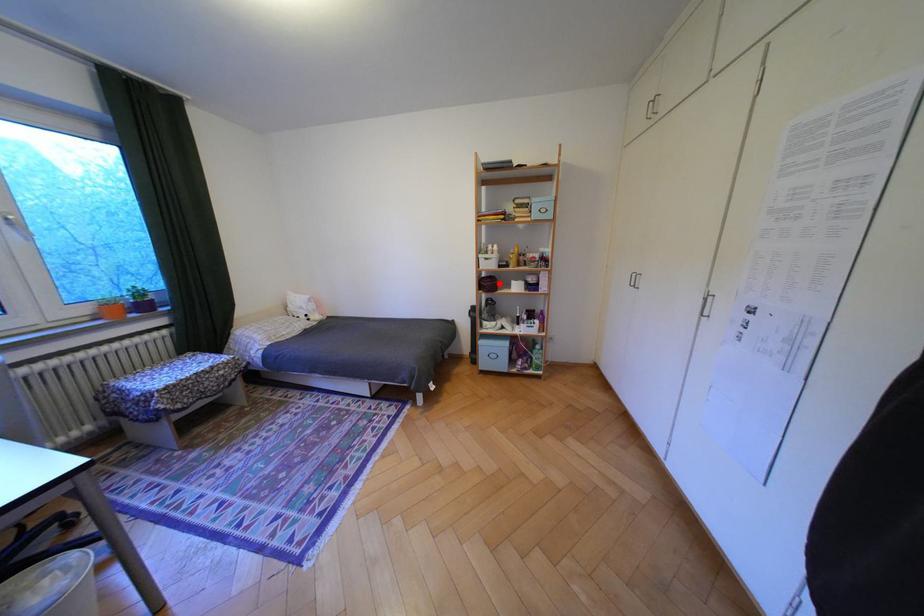
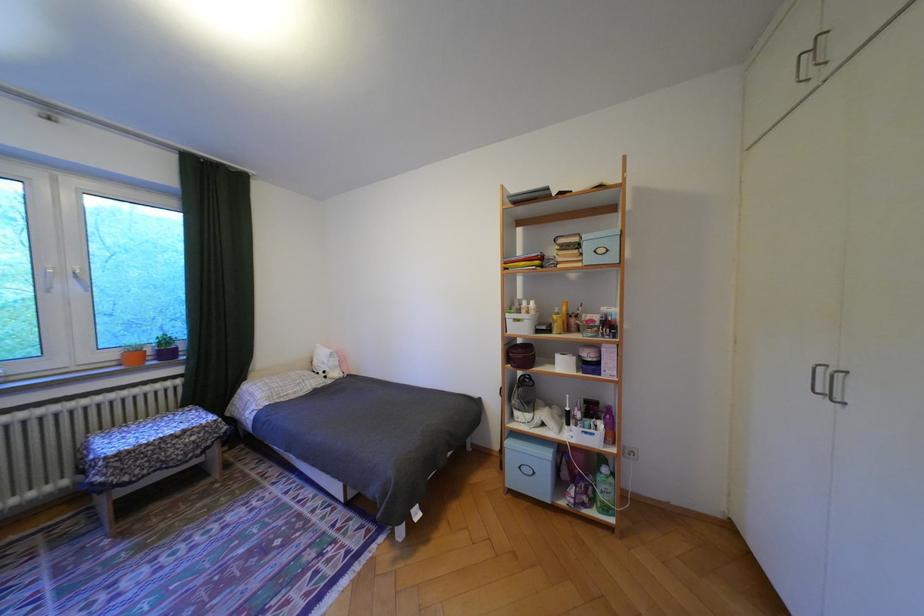
Question: I am providing you with two images of the same scene from different viewpoints. A red point is marked on the first image. Is the red point's position out of view in image 2?

Choices:
 (A) Yes
 (B) No

Answer: (B)